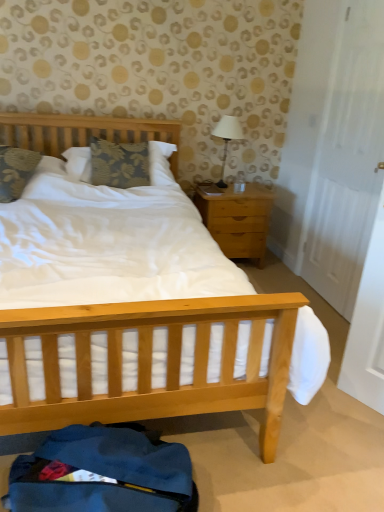
Measure the distance between point (x=219, y=222) and camera.

Point (x=219, y=222) is 3.09 meters away from camera.

This screenshot has height=512, width=384. Identify the location of light wood/texture nightstand at right. (238, 220).

Image resolution: width=384 pixels, height=512 pixels. I want to click on white fabric-covered lamp at upper right, so click(227, 139).

This screenshot has height=512, width=384. In order to click on white matte door at right in this screenshot , I will do `click(346, 159)`.

Locate an element on the screen. Image resolution: width=384 pixels, height=512 pixels. light wood/texture nightstand at right is located at coordinates (238, 220).

Consider the image. Which object is positioned more to the right, floral fabric pillow at center, positioned as the 2th pillow in left-to-right order, or white matte door at right?

white matte door at right is more to the right.

Consider the image. Which is in front, floral fabric pillow at center, positioned as the first pillow in right-to-left order, or white matte door at right?

white matte door at right is in front.

From the image's perspective, which one is positioned higher, floral fabric pillow at center, positioned as the first pillow in right-to-left order, or white matte door at right?

From the image's view, floral fabric pillow at center, positioned as the first pillow in right-to-left order, is above.

Considering the sizes of objects floral fabric pillow at center, positioned as the 2th pillow in left-to-right order, and white matte door at right in the image provided, who is shorter, floral fabric pillow at center, positioned as the 2th pillow in left-to-right order, or white matte door at right?

Standing shorter between the two is floral fabric pillow at center, positioned as the 2th pillow in left-to-right order.

Are white fabric-covered lamp at upper right and white matte door at right far apart?

Actually, white fabric-covered lamp at upper right and white matte door at right are a little close together.

From a real-world perspective, is white fabric-covered lamp at upper right below white matte door at right?

Yes, from a real-world perspective, white fabric-covered lamp at upper right is beneath white matte door at right.

Is white fabric-covered lamp at upper right wider than white matte door at right?

Yes, white fabric-covered lamp at upper right is wider than white matte door at right.

Can you tell me how much white fabric-covered lamp at upper right and white matte door at right differ in facing direction?

92.3 degrees.

Is light wood/texture nightstand at right facing towards white matte door at right?

No, light wood/texture nightstand at right is not turned towards white matte door at right.

Based on the photo, considering the relative positions of light wood/texture nightstand at right and white matte door at right in the image provided, is light wood/texture nightstand at right behind white matte door at right?

Yes, light wood/texture nightstand at right is further from the viewer.

Considering the positions of objects light wood/texture nightstand at right and white matte door at right in the image provided, who is more to the left, light wood/texture nightstand at right or white matte door at right?

Positioned to the left is light wood/texture nightstand at right.

Would you say light wood/texture nightstand at right is inside or outside white matte door at right?

light wood/texture nightstand at right lies outside white matte door at right.

Is white matte door at right positioned with its back to floral fabric pillow at center, positioned as the 2th pillow in left-to-right order?

No, white matte door at right is not facing away from floral fabric pillow at center, positioned as the 2th pillow in left-to-right order.

From their relative heights in the image, would you say white matte door at right is taller or shorter than floral fabric pillow at center, positioned as the first pillow in right-to-left order?

Clearly, white matte door at right is taller compared to floral fabric pillow at center, positioned as the first pillow in right-to-left order.

Which is more distant, (375,60) or (93,147)?

The point (93,147) is farther.

Is white matte door at right thinner than floral fabric pillow at center, positioned as the first pillow in right-to-left order?

Indeed, white matte door at right has a lesser width compared to floral fabric pillow at center, positioned as the first pillow in right-to-left order.

Could you tell me if floral fabric pillow at left, arranged as the second pillow when viewed from the right, is facing light wood/texture nightstand at right?

No, floral fabric pillow at left, arranged as the second pillow when viewed from the right, is not oriented towards light wood/texture nightstand at right.

What are the coordinates of `nightstand located below the floral fabric pillow at left, arranged as the second pillow when viewed from the right (from the image's perspective)` in the screenshot? It's located at (238, 220).

From the image's perspective, which one is positioned lower, floral fabric pillow at left, arranged as the second pillow when viewed from the right, or light wood/texture nightstand at right?

light wood/texture nightstand at right.

Do you think floral fabric pillow at left, arranged as the second pillow when viewed from the right, is within light wood/texture nightstand at right, or outside of it?

floral fabric pillow at left, arranged as the second pillow when viewed from the right, lies outside light wood/texture nightstand at right.

Consider the image. Which object is thinner, light wood/texture nightstand at right or floral fabric pillow at left, arranged as the first pillow when viewed from the left?

Thinner between the two is light wood/texture nightstand at right.

Is light wood/texture nightstand at right with floral fabric pillow at left, arranged as the first pillow when viewed from the left?

light wood/texture nightstand at right and floral fabric pillow at left, arranged as the first pillow when viewed from the left, are not in contact.

Which object is further away from the camera, light wood/texture nightstand at right or floral fabric pillow at left, arranged as the first pillow when viewed from the left?

light wood/texture nightstand at right is further away from the camera.

How far apart are light wood/texture nightstand at right and floral fabric pillow at left, arranged as the first pillow when viewed from the left?

1.37 meters.

From a real-world perspective, which object rests below the other?

floral fabric pillow at left, arranged as the first pillow when viewed from the left.

What's the angular difference between floral fabric pillow at center, positioned as the 2th pillow in left-to-right order, and floral fabric pillow at left, arranged as the second pillow when viewed from the right,'s facing directions?

The angle between the facing direction of floral fabric pillow at center, positioned as the 2th pillow in left-to-right order, and the facing direction of floral fabric pillow at left, arranged as the second pillow when viewed from the right, is 21.6 degrees.

Is floral fabric pillow at center, positioned as the 2th pillow in left-to-right order, far from floral fabric pillow at left, arranged as the second pillow when viewed from the right?

floral fabric pillow at center, positioned as the 2th pillow in left-to-right order, is near floral fabric pillow at left, arranged as the second pillow when viewed from the right, not far away.

From the image's perspective, is floral fabric pillow at center, positioned as the 2th pillow in left-to-right order, located beneath floral fabric pillow at left, arranged as the first pillow when viewed from the left?

Incorrect, from the image's perspective, floral fabric pillow at center, positioned as the 2th pillow in left-to-right order, is higher than floral fabric pillow at left, arranged as the first pillow when viewed from the left.

Find the location of `the 1st pillow located beneath the white matte door at right (from a real-world perspective)`. the 1st pillow located beneath the white matte door at right (from a real-world perspective) is located at coordinates (121, 163).

Identify the location of door in front of the white fabric-covered lamp at upper right. (346, 159).

Based on their spatial positions, is white matte door at right or floral fabric pillow at left, arranged as the first pillow when viewed from the left, closer to light wood/texture nightstand at right?

white matte door at right is positioned closer to the anchor light wood/texture nightstand at right.

When comparing their distances from floral fabric pillow at left, arranged as the first pillow when viewed from the left, does white fabric-covered lamp at upper right or light wood/texture nightstand at right seem closer?

The object closer to floral fabric pillow at left, arranged as the first pillow when viewed from the left, is light wood/texture nightstand at right.

In the scene shown: When comparing their distances from white matte door at right, does floral fabric pillow at center, positioned as the 2th pillow in left-to-right order, or light wood/texture nightstand at right seem closer?

Among the two, light wood/texture nightstand at right is located nearer to white matte door at right.

When comparing their distances from light wood/texture nightstand at right, does floral fabric pillow at left, arranged as the second pillow when viewed from the right, or floral fabric pillow at center, positioned as the first pillow in right-to-left order, seem closer?

floral fabric pillow at center, positioned as the first pillow in right-to-left order, is closer to light wood/texture nightstand at right.

From the image, which object appears to be farther from floral fabric pillow at center, positioned as the first pillow in right-to-left order, light wood/texture nightstand at right or white matte door at right?

white matte door at right is positioned further to the anchor floral fabric pillow at center, positioned as the first pillow in right-to-left order.

When comparing their distances from floral fabric pillow at left, arranged as the first pillow when viewed from the left, does floral fabric pillow at center, positioned as the first pillow in right-to-left order, or white matte door at right seem closer?

floral fabric pillow at center, positioned as the first pillow in right-to-left order, lies closer to floral fabric pillow at left, arranged as the first pillow when viewed from the left, than the other object.

Looking at the image, which one is located closer to white matte door at right, floral fabric pillow at center, positioned as the 2th pillow in left-to-right order, or floral fabric pillow at left, arranged as the first pillow when viewed from the left?

floral fabric pillow at center, positioned as the 2th pillow in left-to-right order, is closer to white matte door at right.

From the image, which object appears to be farther from floral fabric pillow at left, arranged as the first pillow when viewed from the left, white fabric-covered lamp at upper right or floral fabric pillow at center, positioned as the 2th pillow in left-to-right order?

Among the two, white fabric-covered lamp at upper right is located further to floral fabric pillow at left, arranged as the first pillow when viewed from the left.

Locate an element on the screen. pillow between floral fabric pillow at left, arranged as the second pillow when viewed from the right, and light wood/texture nightstand at right from left to right is located at coordinates (121, 163).

This screenshot has width=384, height=512. In order to click on table lamp between floral fabric pillow at left, arranged as the first pillow when viewed from the left, and white matte door at right from left to right in this screenshot , I will do `click(227, 139)`.

Where is `nightstand located between floral fabric pillow at left, arranged as the first pillow when viewed from the left, and white matte door at right in the left-right direction`? nightstand located between floral fabric pillow at left, arranged as the first pillow when viewed from the left, and white matte door at right in the left-right direction is located at coordinates (238, 220).

Where is `pillow located between floral fabric pillow at left, arranged as the first pillow when viewed from the left, and white matte door at right in the left-right direction`? Image resolution: width=384 pixels, height=512 pixels. pillow located between floral fabric pillow at left, arranged as the first pillow when viewed from the left, and white matte door at right in the left-right direction is located at coordinates (121, 163).